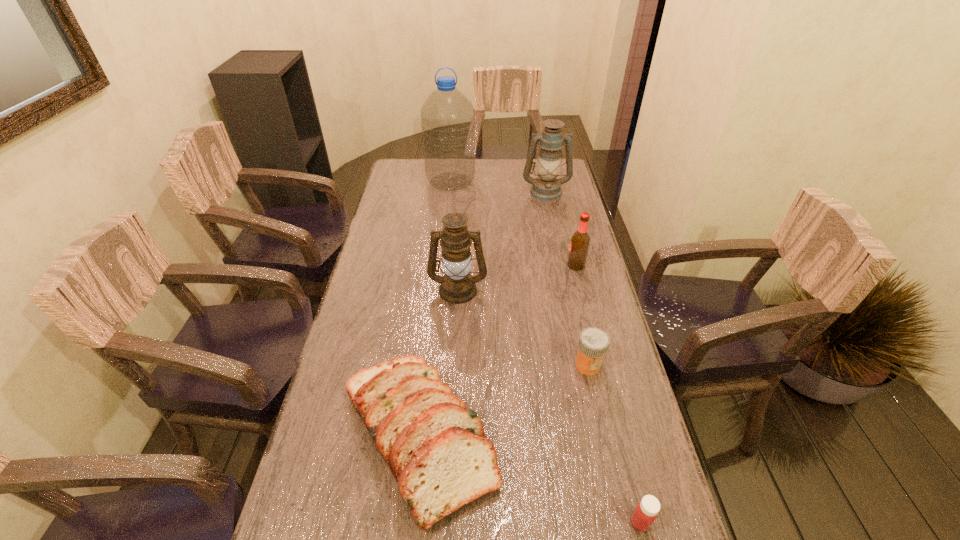
Locate an element on the screen. the tallest object is located at coordinates (447, 117).

At what (x,y) coordinates should I click in order to perform the action: click on the farther oil lamp. Please return your answer as a coordinate pair (x, y). This screenshot has height=540, width=960. Looking at the image, I should click on (547, 187).

Identify the location of the nearer oil lamp. (457, 286).

This screenshot has height=540, width=960. I want to click on the fourth farthest object, so click(457, 286).

Find the location of `the fifth nearest object`. the fifth nearest object is located at coordinates (580, 240).

In order to click on the fourth tallest object in this screenshot , I will do `click(580, 240)`.

Find the location of a particular element. The width and height of the screenshot is (960, 540). the fifth tallest object is located at coordinates (436, 449).

Locate an element on the screen. The height and width of the screenshot is (540, 960). the farther medicine is located at coordinates (593, 343).

Locate an element on the screen. The height and width of the screenshot is (540, 960). the taller medicine is located at coordinates (593, 343).

You are a GUI agent. You are given a task and a screenshot of the screen. Output one action in this format:
    pyautogui.click(x=<x>, y=<y>)
    Task: Click on the nearer medicine
    The image size is (960, 540).
    Given the screenshot: What is the action you would take?
    pyautogui.click(x=645, y=513)